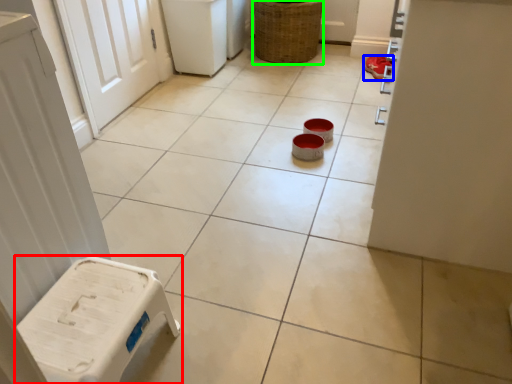
Question: Considering the real-world distances, which object is closest to furniture (highlighted by a red box)? footwear (highlighted by a blue box) or basket (highlighted by a green box).

Choices:
 (A) footwear
 (B) basket

Answer: (A)